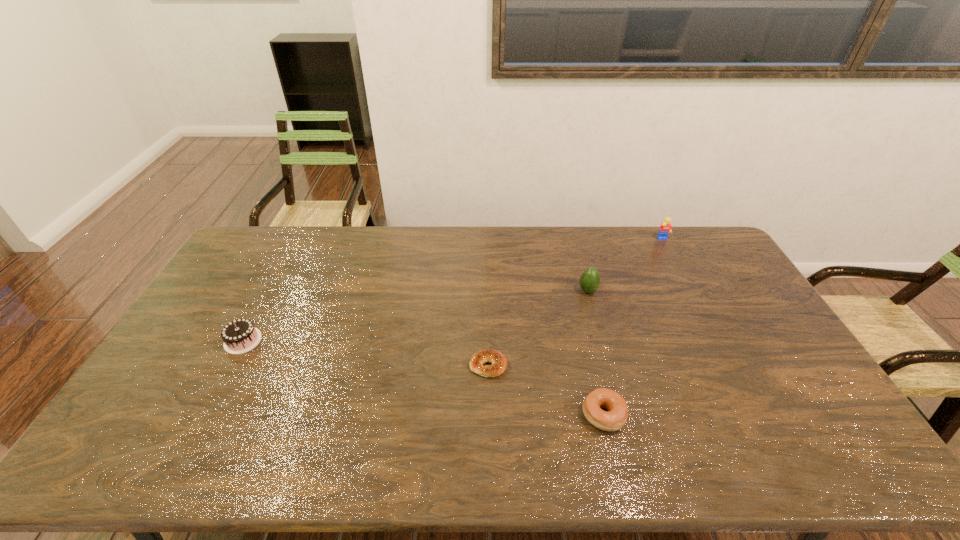
At what (x,y) coordinates should I click in order to perform the action: click on vacant area between the farther bagel and the Lego. Please return your answer as a coordinate pair (x, y). Image resolution: width=960 pixels, height=540 pixels. Looking at the image, I should click on (576, 302).

You are a GUI agent. You are given a task and a screenshot of the screen. Output one action in this format:
    pyautogui.click(x=<x>, y=<y>)
    Task: Click on the free spot between the avocado and the rightmost object
    
    Given the screenshot: What is the action you would take?
    pyautogui.click(x=625, y=265)

In order to click on vacant area between the leftmost object and the farther bagel in this screenshot , I will do `click(366, 353)`.

This screenshot has height=540, width=960. Find the location of `free point between the fourth tallest object and the rightmost object`. free point between the fourth tallest object and the rightmost object is located at coordinates (634, 327).

Where is `vacant area between the rightmost object and the second farthest object`? The height and width of the screenshot is (540, 960). vacant area between the rightmost object and the second farthest object is located at coordinates (625, 265).

Identify the location of unoccupied position between the avocado and the nearest object. This screenshot has width=960, height=540. (595, 353).

This screenshot has width=960, height=540. Identify the location of vacant space in between the farthest object and the avocado. (625, 265).

This screenshot has width=960, height=540. I want to click on empty space between the shortest object and the leftmost object, so click(x=366, y=353).

The height and width of the screenshot is (540, 960). Find the location of `free space between the chocolate cake and the rightmost object`. free space between the chocolate cake and the rightmost object is located at coordinates (453, 290).

Locate an element on the screen. Image resolution: width=960 pixels, height=540 pixels. free space between the shorter bagel and the second shortest object is located at coordinates (546, 390).